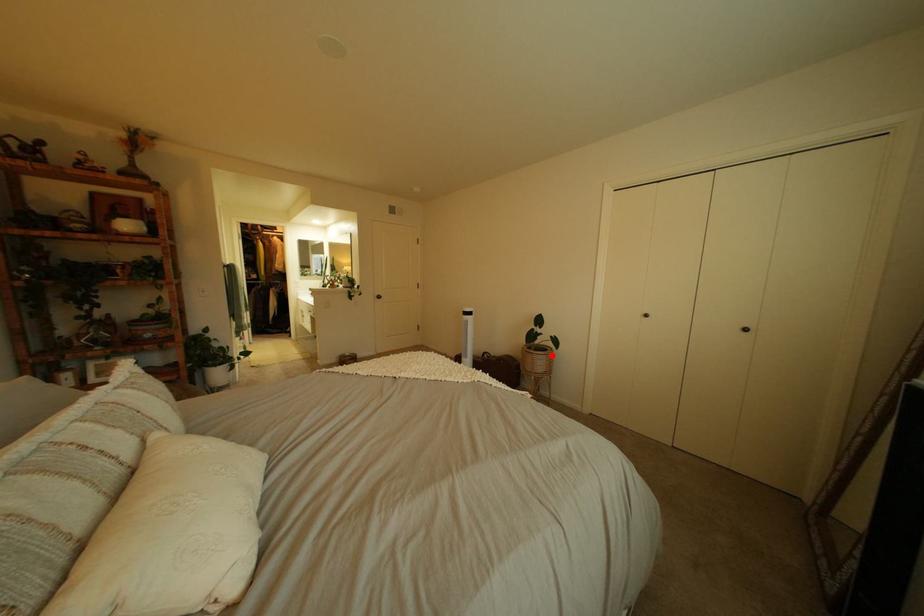
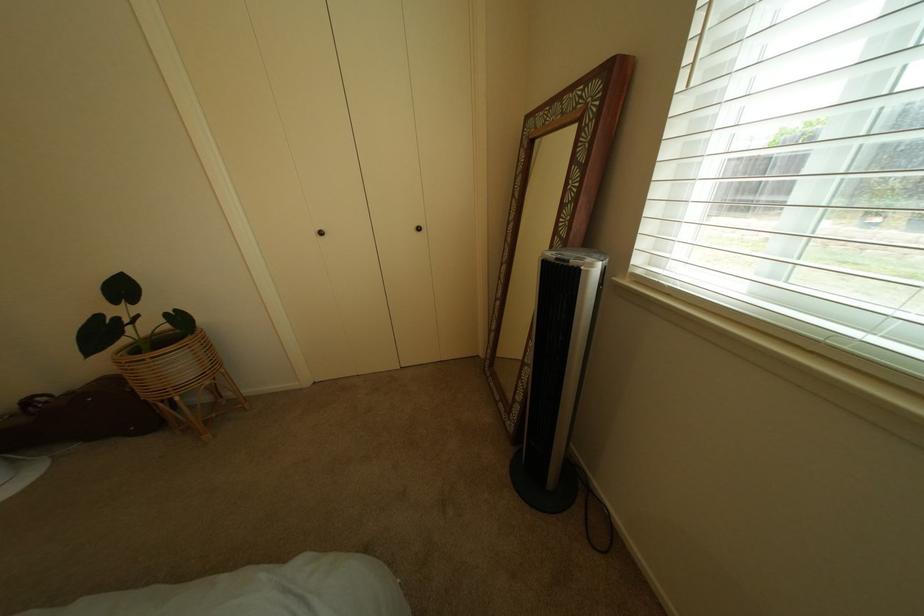
Locate, in the second image, the point that corresponds to the highlighted location in the first image.

(167, 359)